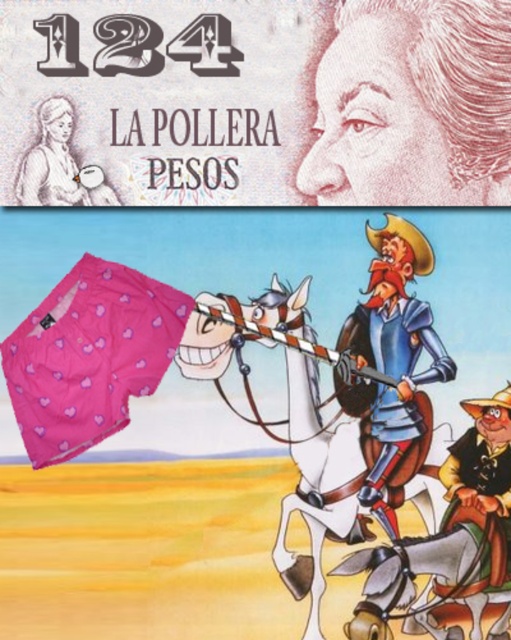
You are an art student analyzing the composition of this banknote design. You notice the smooth blue armor at center and the pink fabric skirt at upper left. Based on their positions, which object is placed higher in the image?

The pink fabric skirt at upper left is placed higher in the image than the smooth blue armor at center.